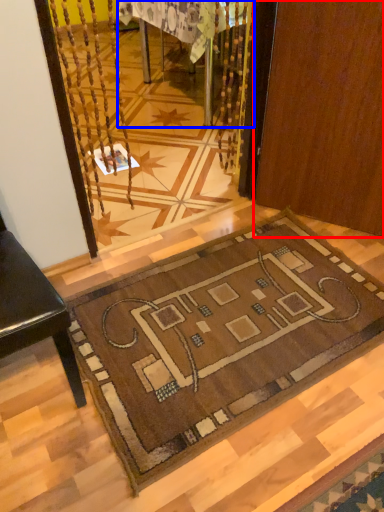
Question: Which object is further to the camera taking this photo, door (highlighted by a red box) or table (highlighted by a blue box)?

Choices:
 (A) door
 (B) table

Answer: (B)